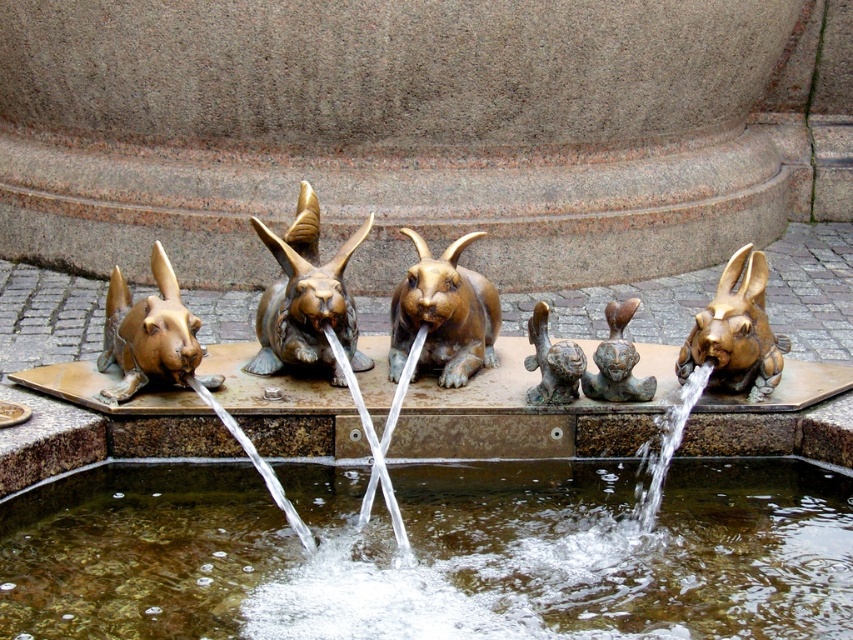
Question: Which of the following is the farthest from the observer?

Choices:
 (A) (114, 294)
 (B) (424, 298)
 (C) (727, 298)
 (D) (488, 602)

Answer: (A)

Question: Which object is closer to the camera taking this photo?

Choices:
 (A) gold-bronze rabbit at right
 (B) brass rabbit at center
 (C) gold metallic rabbit at left
 (D) clear water at fountain center

Answer: (D)

Question: Can you confirm if gold metallic rabbits at center is positioned to the right of brass rabbit at center?

Choices:
 (A) no
 (B) yes

Answer: (A)

Question: Which object appears closest to the camera in this image?

Choices:
 (A) brass rabbit at center
 (B) bronze/brass figure at center
 (C) gold metallic rabbit at left

Answer: (A)

Question: Can you confirm if gold-bronze rabbit at center is thinner than bronze/brass figure at center?

Choices:
 (A) yes
 (B) no

Answer: (B)

Question: Is gold metallic rabbit at left wider than gold-bronze rabbit at right?

Choices:
 (A) yes
 (B) no

Answer: (A)